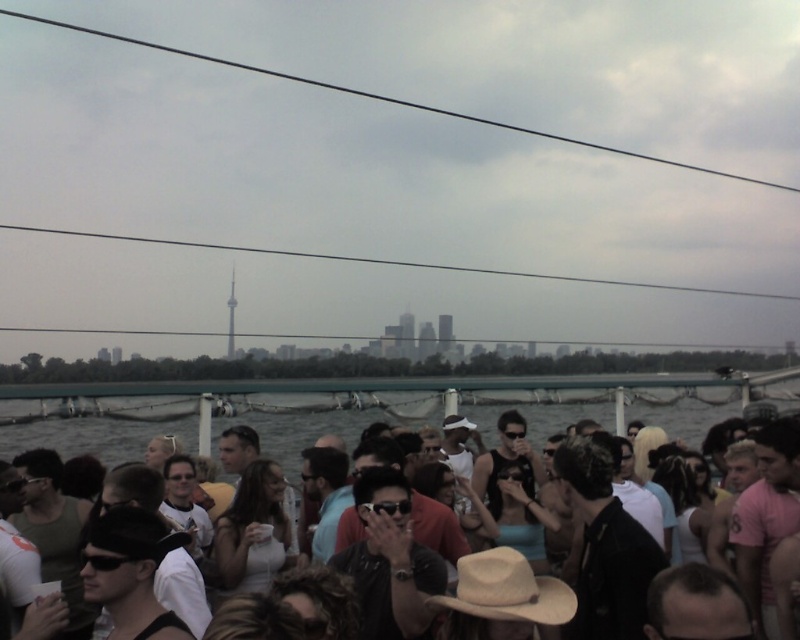
Question: Does green water at lower center have a lesser width compared to matte black hat at center?

Choices:
 (A) no
 (B) yes

Answer: (A)

Question: Which point is farther from the camera taking this photo?

Choices:
 (A) (320, 416)
 (B) (686, 387)

Answer: (B)

Question: Which of the following is the farthest from the observer?

Choices:
 (A) green water at lower center
 (B) matte black hat at center

Answer: (A)

Question: Does green water at lower center come in front of matte black hat at center?

Choices:
 (A) no
 (B) yes

Answer: (A)

Question: Is green water at lower center further to the viewer compared to matte black hat at center?

Choices:
 (A) no
 (B) yes

Answer: (B)